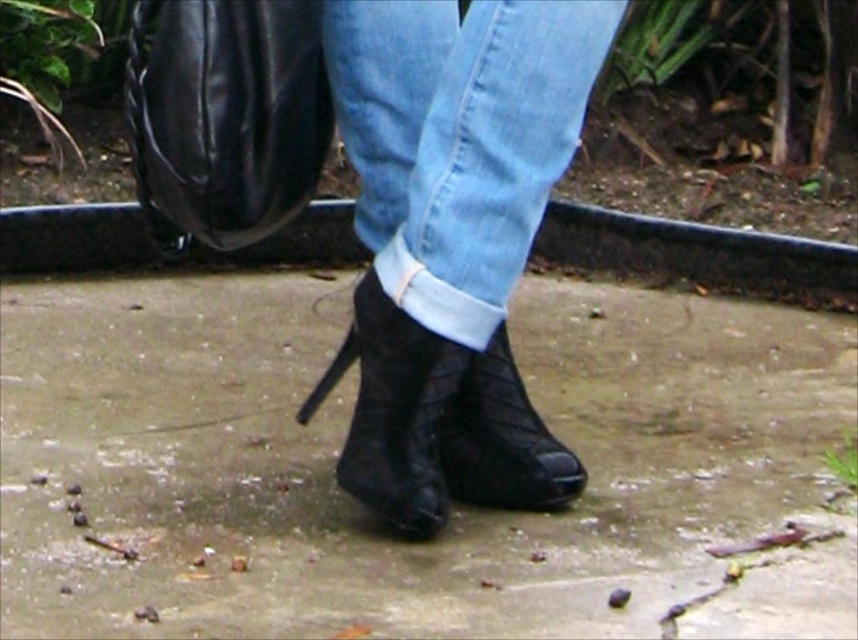
Find the location of a particular element. This screenshot has width=858, height=640. slate gray concrete at center is located at coordinates (x=340, y=444).

Which is behind, point (146, 406) or point (439, 412)?

Positioned behind is point (146, 406).

Is point (837, 376) positioned after point (379, 406)?

Yes.

In order to click on slate gray concrete at center in this screenshot , I will do `click(340, 444)`.

Does slate gray concrete at center appear on the left side of black quilted boot at center?

Correct, you'll find slate gray concrete at center to the left of black quilted boot at center.

Where is `slate gray concrete at center`? The height and width of the screenshot is (640, 858). slate gray concrete at center is located at coordinates (340, 444).

I want to click on slate gray concrete at center, so click(340, 444).

I want to click on slate gray concrete at center, so click(340, 444).

Measure the distance from black suede boot at center to black quilted boot at center.

black suede boot at center and black quilted boot at center are 4.92 inches apart.

Between point (397, 410) and point (517, 428), which one is positioned behind?

Point (517, 428)

This screenshot has width=858, height=640. In order to click on black suede boot at center in this screenshot , I will do click(394, 412).